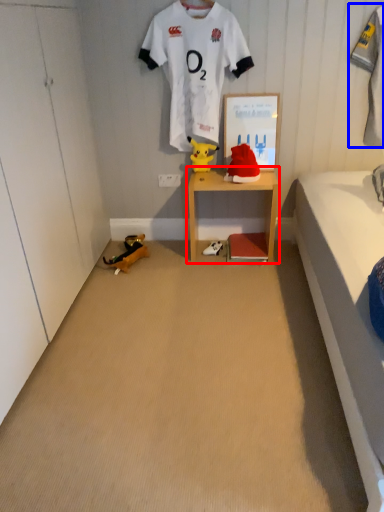
Question: Which of the following is the farthest to the observer, shelf (highlighted by a red box) or clothing (highlighted by a blue box)?

Choices:
 (A) shelf
 (B) clothing

Answer: (A)